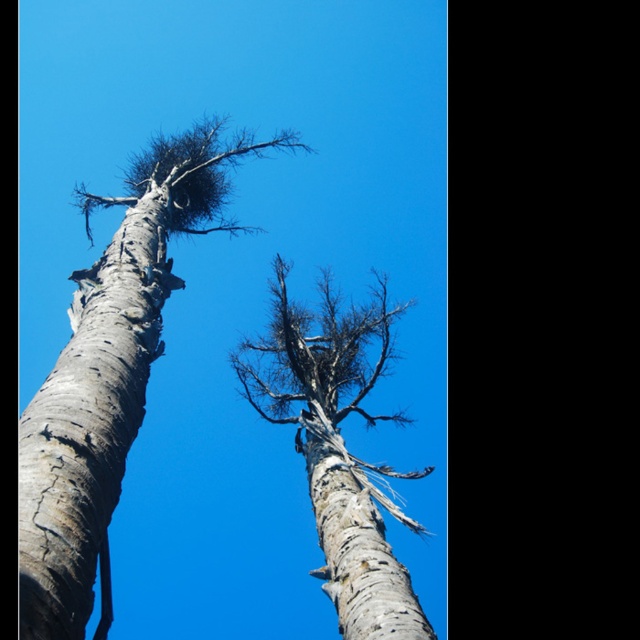
Question: Is gray textured bark birch tree at left below gray textured bark at left?

Choices:
 (A) no
 (B) yes

Answer: (A)

Question: Does gray textured bark birch tree at left have a smaller size compared to gray textured bark at left?

Choices:
 (A) no
 (B) yes

Answer: (A)

Question: Can you confirm if gray textured bark birch tree at left is bigger than gray textured bark at left?

Choices:
 (A) no
 (B) yes

Answer: (B)

Question: Which object appears closest to the camera in this image?

Choices:
 (A) gray textured bark at left
 (B) gray textured bark birch tree at left

Answer: (A)

Question: Among these objects, which one is nearest to the camera?

Choices:
 (A) gray bark birch tree at center
 (B) gray textured bark at left
 (C) white bark tree trunk at center
 (D) gray textured bark birch tree at left

Answer: (B)

Question: Which point is closer to the camera?

Choices:
 (A) (124, 298)
 (B) (29, 417)

Answer: (B)